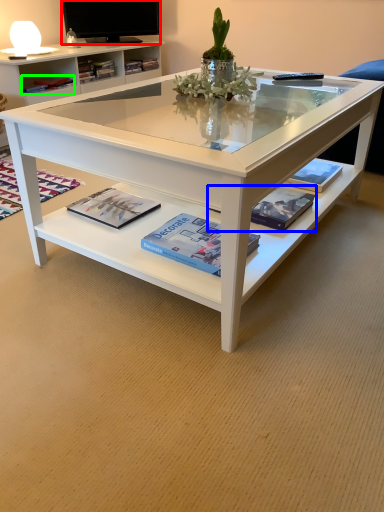
Question: Which object is the farthest from television (highlighted by a red box)? Choose among these: magazine (highlighted by a blue box) or book (highlighted by a green box).

Choices:
 (A) magazine
 (B) book

Answer: (A)